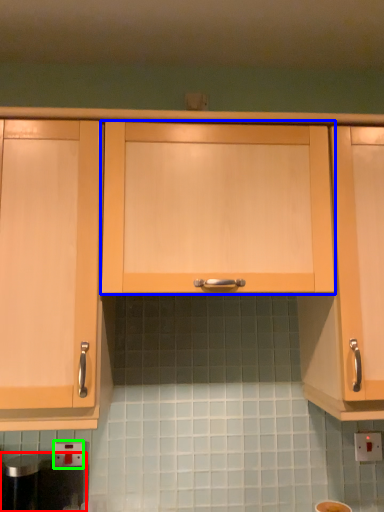
Question: Based on their relative distances, which object is farther from appliance (highlighted by a red box)? Choose from cabinetry (highlighted by a blue box) and electric outlet (highlighted by a green box).

Choices:
 (A) cabinetry
 (B) electric outlet

Answer: (A)